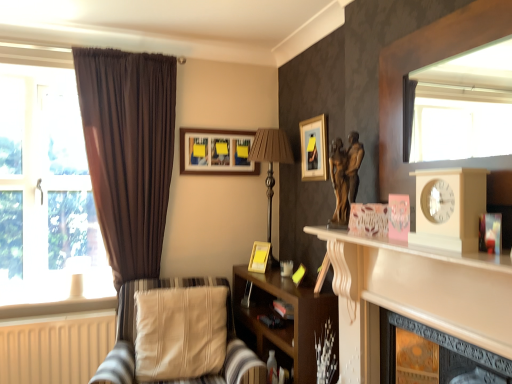
Where is `bronze statue at center-right`? The height and width of the screenshot is (384, 512). bronze statue at center-right is located at coordinates (345, 176).

You are a GUI agent. You are given a task and a screenshot of the screen. Output one action in this format:
    pyautogui.click(x=<x>, y=<y>)
    Task: Click on the matte white lampshade at left, placed as the first lamp when sorted from left to right
    The height and width of the screenshot is (384, 512).
    Given the screenshot: What is the action you would take?
    pyautogui.click(x=77, y=274)

The width and height of the screenshot is (512, 384). What do you see at coordinates (57, 307) in the screenshot? I see `white wood at lower left` at bounding box center [57, 307].

Measure the distance between point (425, 281) and camera.

A distance of 4.40 feet exists between point (425, 281) and camera.

In order to click on bronze statue at center-right in this screenshot , I will do `click(345, 176)`.

Considering the positions of point (36, 205) and point (342, 185), is point (36, 205) closer or farther from the camera than point (342, 185)?

Clearly, point (36, 205) is more distant from the camera than point (342, 185).

From the image's perspective, is transparent glass window at left located above bronze statue at center-right?

Yes, from the image's perspective, transparent glass window at left is above bronze statue at center-right.

Which object is closer to the camera, transparent glass window at left or bronze statue at center-right?

bronze statue at center-right.

Could you tell me if transparent glass window at left is facing bronze statue at center-right?

No, transparent glass window at left is not turned towards bronze statue at center-right.

Is point (279, 154) closer to camera compared to point (321, 128)?

No, it is behind (321, 128).

This screenshot has width=512, height=384. I want to click on the 1st picture frame positioned above the brown fabric lamp at center, acting as the 1th lamp starting from the top (from a real-world perspective), so point(314,149).

Considering the relative positions of brown fabric lamp at center, acting as the first lamp starting from the right, and matte gold picture frame at upper center, arranged as the third picture frame when viewed from the back, in the image provided, is brown fabric lamp at center, acting as the first lamp starting from the right, to the left or to the right of matte gold picture frame at upper center, arranged as the third picture frame when viewed from the back,?

Based on their positions, brown fabric lamp at center, acting as the first lamp starting from the right, is located to the left of matte gold picture frame at upper center, arranged as the third picture frame when viewed from the back.

Is brown fabric lamp at center, acting as the first lamp starting from the right, shorter than matte gold picture frame at upper center, which is the 2th picture frame in bottom-to-top order?

Incorrect, the height of brown fabric lamp at center, acting as the first lamp starting from the right, does not fall short of that of matte gold picture frame at upper center, which is the 2th picture frame in bottom-to-top order.

From a real-world perspective, is wooden photo frame at center, which is counted as the first picture frame, starting from the bottom, above or below matte white lampshade at left, placed as the first lamp when sorted from left to right?

Clearly, from a real-world perspective, wooden photo frame at center, which is counted as the first picture frame, starting from the bottom, is above matte white lampshade at left, placed as the first lamp when sorted from left to right.

Between wooden photo frame at center, which is counted as the third picture frame, starting from the top, and matte white lampshade at left, the second lamp from the right, which one has smaller size?

wooden photo frame at center, which is counted as the third picture frame, starting from the top.

From the image's perspective, is wooden photo frame at center, marked as the 2th picture frame in a left-to-right arrangement, beneath matte white lampshade at left, placed as the first lamp when sorted from left to right?

No, from the image's perspective, wooden photo frame at center, marked as the 2th picture frame in a left-to-right arrangement, is not below matte white lampshade at left, placed as the first lamp when sorted from left to right.

Would you say wooden photo frame at center, which is counted as the third picture frame, starting from the top, is to the left or to the right of matte white lampshade at left, the second lamp from the right, in the picture?

From the image, it's evident that wooden photo frame at center, which is counted as the third picture frame, starting from the top, is to the right of matte white lampshade at left, the second lamp from the right.

Between brown wooden shelf at lower left and wooden photo frame at center, which is counted as the first picture frame, starting from the bottom, which one has less height?

With less height is wooden photo frame at center, which is counted as the first picture frame, starting from the bottom.

From a real-world perspective, which object stands above the other?

wooden photo frame at center, which is counted as the first picture frame, starting from the bottom, from a real-world perspective.

Could you measure the distance between brown wooden shelf at lower left and wooden photo frame at center, the 2th picture frame viewed from the back?

A distance of 15.76 inches exists between brown wooden shelf at lower left and wooden photo frame at center, the 2th picture frame viewed from the back.

Is brown wooden shelf at lower left behind wooden photo frame at center, the 2th picture frame viewed from the back?

That is False.

From the image's perspective, is white wood at lower left positioned above or below brown fabric lamp at center, acting as the 1th lamp starting from the top?

From the image's perspective, white wood at lower left appears below brown fabric lamp at center, acting as the 1th lamp starting from the top.

Is brown fabric lamp at center, the second lamp positioned from the left, at the back of white wood at lower left?

white wood at lower left is not turned away from brown fabric lamp at center, the second lamp positioned from the left.

What's the angular difference between white wood at lower left and brown fabric lamp at center, which appears as the 2th lamp when ordered from the bottom,'s facing directions?

They differ by 92.3 degrees in their facing directions.

Considering the relative positions of white wood at lower left and brown fabric lamp at center, the second lamp positioned from the left, in the image provided, is white wood at lower left to the left of brown fabric lamp at center, the second lamp positioned from the left, from the viewer's perspective?

Correct, you'll find white wood at lower left to the left of brown fabric lamp at center, the second lamp positioned from the left.

Is matte white lampshade at left, which ranks as the second lamp in top-to-bottom order, positioned beyond the bounds of white glossy mantle at right?

Yes.

Based on the photo, can you tell me how much matte white lampshade at left, the second lamp from the right, and white glossy mantle at right differ in facing direction?

matte white lampshade at left, the second lamp from the right, and white glossy mantle at right are facing 91.2 degrees away from each other.

In the image, is matte white lampshade at left, which ranks as the second lamp in top-to-bottom order, positioned in front of or behind white glossy mantle at right?

Clearly, matte white lampshade at left, which ranks as the second lamp in top-to-bottom order, is behind white glossy mantle at right.

Considering the relative sizes of matte white lampshade at left, placed as the first lamp when sorted from left to right, and white glossy mantle at right in the image provided, is matte white lampshade at left, placed as the first lamp when sorted from left to right, shorter than white glossy mantle at right?

Yes, matte white lampshade at left, placed as the first lamp when sorted from left to right, is shorter than white glossy mantle at right.

Consider the image. How many degrees apart are the facing directions of brown velvet curtain at left and beige fabric cushion at lower left?

brown velvet curtain at left and beige fabric cushion at lower left are facing 12.2 degrees away from each other.

I want to click on curtain to the left of beige fabric cushion at lower left, so click(128, 152).

Between brown velvet curtain at left and beige fabric cushion at lower left, which one appears on the right side from the viewer's perspective?

beige fabric cushion at lower left is more to the right.

The height and width of the screenshot is (384, 512). Find the location of `sculpture in front of the transparent glass window at left`. sculpture in front of the transparent glass window at left is located at coordinates (345, 176).

Find the location of a particular element. The image size is (512, 384). picture frame that appears on the right of brown fabric lamp at center, which appears as the 2th lamp when ordered from the bottom is located at coordinates [x=314, y=149].

Considering their positions, is white wood at lower left positioned closer to wooden framed picture at upper center, the third picture frame when ordered from right to left, than bronze statue at center-right?

The object closer to wooden framed picture at upper center, the third picture frame when ordered from right to left, is white wood at lower left.

Based on the photo, when comparing their distances from wooden photo frame at center, marked as the 2th picture frame in a left-to-right arrangement, does beige fabric cushion at lower left or brown velvet curtain at left seem further?

Based on the image, brown velvet curtain at left appears to be further to wooden photo frame at center, marked as the 2th picture frame in a left-to-right arrangement.

Which object lies nearer to the anchor point matte gold picture frame at upper center, the first picture frame when ordered from front to back, brown fabric lamp at center, the second lamp positioned from the left, or transparent glass window at left?

brown fabric lamp at center, the second lamp positioned from the left, is closer to matte gold picture frame at upper center, the first picture frame when ordered from front to back.

Which object lies further to the anchor point white glossy mantle at right, transparent glass window at left or matte gold picture frame at upper center, the first picture frame when ordered from front to back?

transparent glass window at left is positioned further to the anchor white glossy mantle at right.

Considering their positions, is beige fabric cushion at lower left positioned closer to bronze statue at center-right than beige wooden clock at right?

The object closer to bronze statue at center-right is beige wooden clock at right.

Looking at the image, which one is located further to white glossy mantle at right, bronze statue at center-right or brown wooden shelf at lower left?

brown wooden shelf at lower left.

Considering their positions, is brown wooden shelf at lower left positioned closer to transparent glass window at left than bronze statue at center-right?

brown wooden shelf at lower left.

When comparing their distances from bronze statue at center-right, does matte white lampshade at left, which ranks as the second lamp in top-to-bottom order, or white wood at lower left seem further?

matte white lampshade at left, which ranks as the second lamp in top-to-bottom order, is further to bronze statue at center-right.

The image size is (512, 384). What are the coordinates of `clock between white glossy mantle at right and matte gold picture frame at upper center, the second picture frame positioned from the top, in the front-back direction` in the screenshot? It's located at (449, 208).

The height and width of the screenshot is (384, 512). I want to click on picture frame located between beige wooden clock at right and brown fabric lamp at center, which appears as the 2th lamp when ordered from the bottom, in the depth direction, so click(314, 149).

Identify the location of curtain located between beige wooden clock at right and wooden framed picture at upper center, which appears as the 1th picture frame when viewed from the top, in the depth direction. Image resolution: width=512 pixels, height=384 pixels. (128, 152).

Image resolution: width=512 pixels, height=384 pixels. Find the location of `chair between transparent glass window at left and matte gold picture frame at upper center, which is the 2th picture frame in bottom-to-top order, in the horizontal direction`. chair between transparent glass window at left and matte gold picture frame at upper center, which is the 2th picture frame in bottom-to-top order, in the horizontal direction is located at coordinates (135, 327).